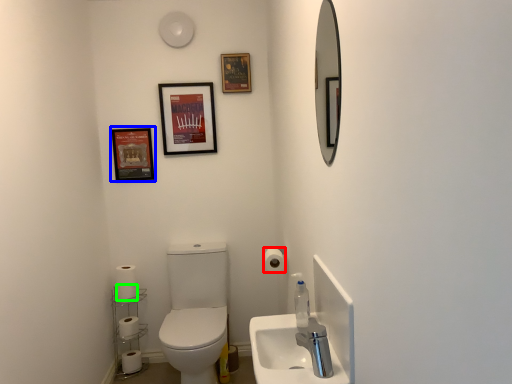
Question: Based on their relative distances, which object is nearer to toilet paper (highlighted by a red box)? Choose from decorative picture (highlighted by a blue box) and toilet paper (highlighted by a green box).

Choices:
 (A) decorative picture
 (B) toilet paper

Answer: (B)